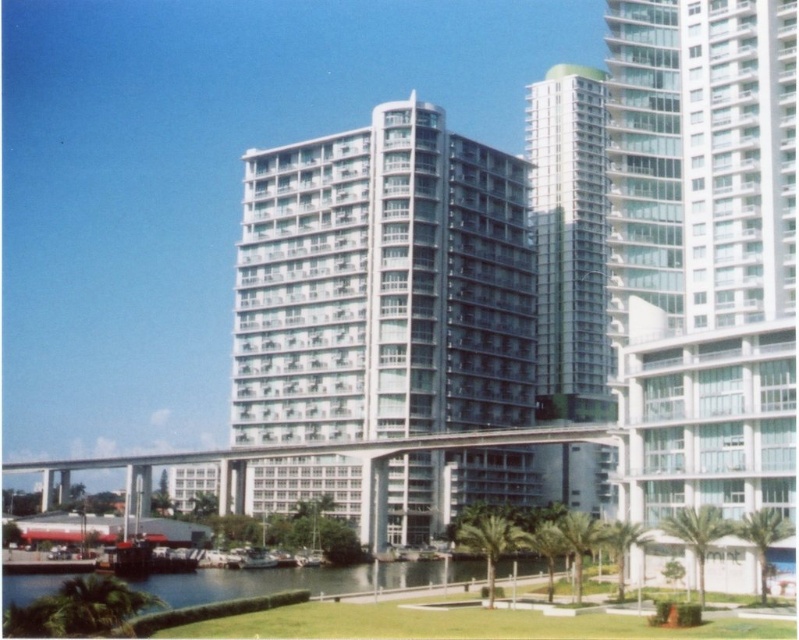
You are standing at the point marked by the coordinates point (382, 285) in the image. What is the nearest object to you?

The point (382, 285) marks the white glass building at center, so the nearest object to you is the white glass building at center.

You are a photographer planning to capture the white glass building at center and the metallic silver boat at center in a single shot. Based on their heights, which object will appear larger in the photo?

The white glass building at center is taller than the metallic silver boat at center, so it will appear larger in the photo.

From the picture: You are a photographer planning to capture the white glass building at center and the metallic silver boat at center in a single frame. Based on their sizes, which object should you focus on to ensure both are clearly visible in the photo?

The white glass building at center is bigger than the metallic silver boat at center, so focusing on the white glass building at center would ensure both are clearly visible as it occupies more space in the frame.